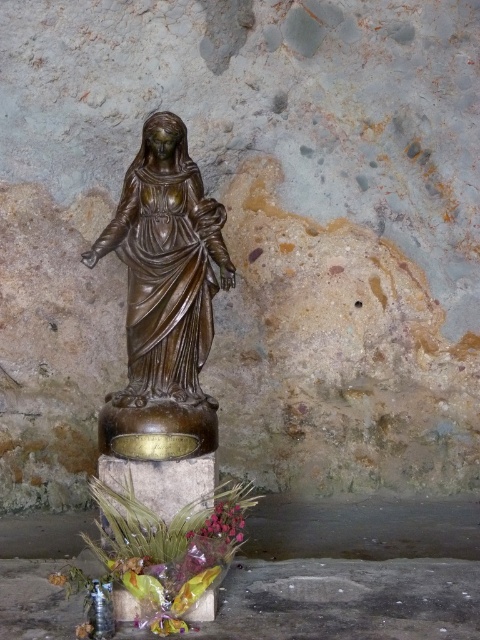
Question: Is bronze statue at center thinner than pink matte petals at lower center?

Choices:
 (A) no
 (B) yes

Answer: (A)

Question: Among these points, which one is nearest to the camera?

Choices:
 (A) pos(149,314)
 (B) pos(239,538)

Answer: (B)

Question: Which point is farther to the camera?

Choices:
 (A) bronze statue at center
 (B) pink matte petals at lower center

Answer: (A)

Question: Among these points, which one is farthest from the camera?

Choices:
 (A) (195, 321)
 (B) (216, 506)

Answer: (A)

Question: Does bronze statue at center have a larger size compared to pink matte petals at lower center?

Choices:
 (A) yes
 (B) no

Answer: (A)

Question: Does bronze statue at center have a smaller size compared to pink matte petals at lower center?

Choices:
 (A) no
 (B) yes

Answer: (A)